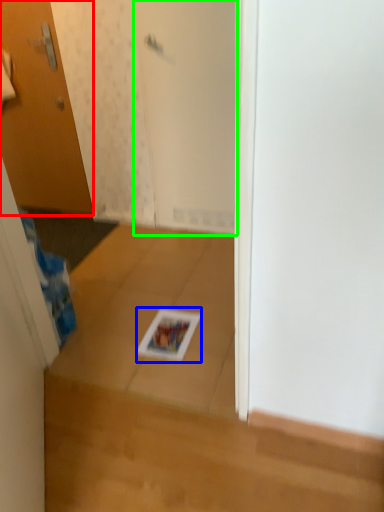
Question: Based on their relative distances, which object is farther from door (highlighted by a red box)? Choose from magazine (highlighted by a blue box) and screen door (highlighted by a green box).

Choices:
 (A) magazine
 (B) screen door

Answer: (A)